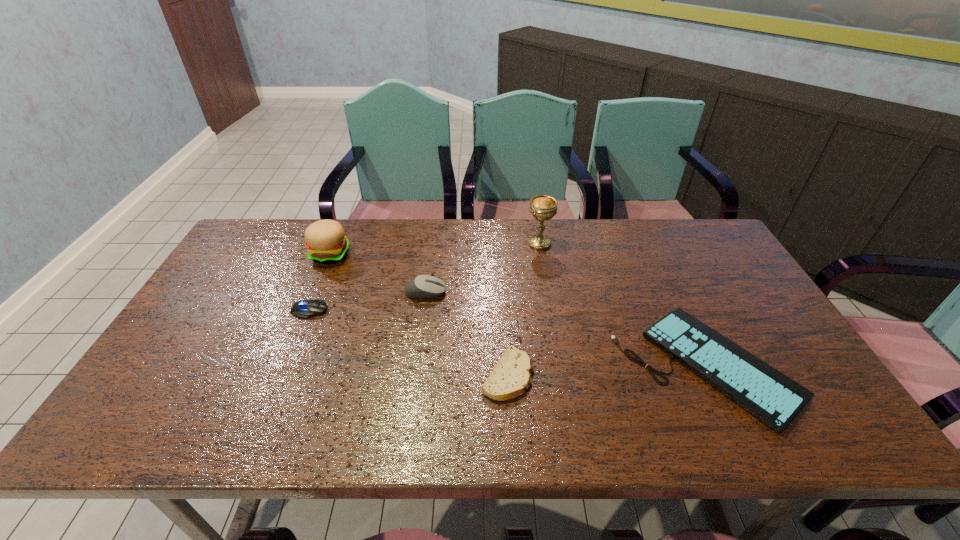
You are a GUI agent. You are given a task and a screenshot of the screen. Output one action in this format:
    pyautogui.click(x=<x>, y=<y>)
    Task: Click on the tallest object
    
    Given the screenshot: What is the action you would take?
    [x=543, y=207]

I want to click on the second object from right to left, so click(x=543, y=207).

The height and width of the screenshot is (540, 960). What are the coordinates of `hamburger` in the screenshot? It's located at (326, 243).

Identify the location of the farther computer mouse. (422, 286).

Find the location of a particular element. Image resolution: width=960 pixels, height=540 pixels. the third tallest object is located at coordinates (422, 286).

Locate an element on the screen. Image resolution: width=960 pixels, height=540 pixels. the left computer mouse is located at coordinates (305, 309).

Locate an element on the screen. the shorter computer mouse is located at coordinates (305, 309).

Find the location of a particular element. The width and height of the screenshot is (960, 540). computer keyboard is located at coordinates (774, 398).

Where is `the third object from right to left`? The height and width of the screenshot is (540, 960). the third object from right to left is located at coordinates (511, 376).

Where is `vacant space located 0.080m on the left of the tallest object`? vacant space located 0.080m on the left of the tallest object is located at coordinates (502, 244).